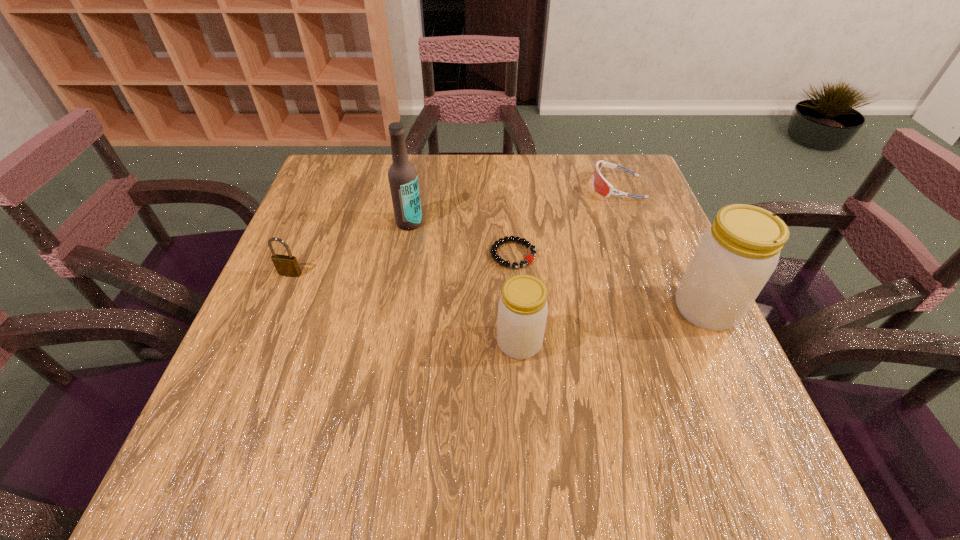
At what (x,y) coordinates should I click in order to perform the action: click on vacant area between the padlock and the farthest object. Please return your answer as a coordinate pair (x, y). Looking at the image, I should click on (453, 231).

This screenshot has height=540, width=960. Identify the location of free space between the bracelet and the right jar. (610, 282).

You are a GUI agent. You are given a task and a screenshot of the screen. Output one action in this format:
    pyautogui.click(x=<x>, y=<y>)
    Task: Click on the free space between the fifth object from right to left and the fourth shortest object
    The height and width of the screenshot is (540, 960).
    Given the screenshot: What is the action you would take?
    pyautogui.click(x=465, y=283)

Where is `empty space that is in between the goggles and the fifth object from right to left`? empty space that is in between the goggles and the fifth object from right to left is located at coordinates (513, 205).

This screenshot has width=960, height=540. What are the coordinates of `free space between the fifth tallest object and the second farthest object` in the screenshot? It's located at (513, 205).

Locate an element on the screen. free space that is in between the right jar and the shortest object is located at coordinates (610, 282).

The image size is (960, 540). Find the location of `free space between the right jar and the bracelet`. free space between the right jar and the bracelet is located at coordinates (610, 282).

Locate an element on the screen. This screenshot has height=540, width=960. unoccupied area between the taller jar and the shorter jar is located at coordinates (612, 326).

Identify the location of free space between the bracelet and the goggles. This screenshot has width=960, height=540. (565, 221).

Locate an element on the screen. This screenshot has height=540, width=960. free space between the fifth shortest object and the second shortest object is located at coordinates (661, 248).